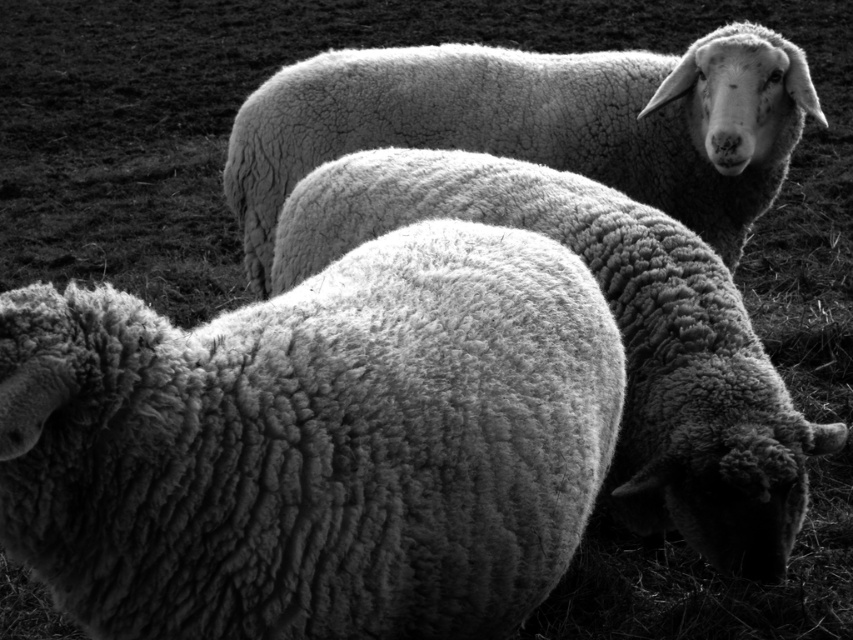
Which is more to the right, fuzzy woolly sheep at center or fuzzy woolen sheep at upper center?

fuzzy woolen sheep at upper center is more to the right.

Measure the distance between point (36, 547) and camera.

Point (36, 547) and camera are 4.34 feet apart.

Who is more distant from viewer, (x=387, y=324) or (x=686, y=60)?

The point (x=686, y=60) is behind.

Identify the location of fuzzy woolly sheep at center. The height and width of the screenshot is (640, 853). (314, 444).

Who is lower down, fuzzy woolly sheep at center or fuzzy woolen sheep at center?

Positioned lower is fuzzy woolly sheep at center.

Which is behind, point (549, 483) or point (688, 291)?

The point (688, 291) is more distant.

Find the location of a particular element. Image resolution: width=853 pixels, height=640 pixels. fuzzy woolly sheep at center is located at coordinates (314, 444).

Does fuzzy woolen sheep at center have a greater width compared to fuzzy woolen sheep at upper center?

Incorrect, fuzzy woolen sheep at center's width does not surpass fuzzy woolen sheep at upper center's.

Find the location of a particular element. Image resolution: width=853 pixels, height=640 pixels. fuzzy woolen sheep at center is located at coordinates (621, 337).

What do you see at coordinates (621, 337) in the screenshot? Image resolution: width=853 pixels, height=640 pixels. I see `fuzzy woolen sheep at center` at bounding box center [621, 337].

You are a GUI agent. You are given a task and a screenshot of the screen. Output one action in this format:
    pyautogui.click(x=<x>, y=<y>)
    Task: Click on the fuzzy woolen sheep at center
    This screenshot has width=853, height=640.
    Given the screenshot: What is the action you would take?
    pyautogui.click(x=621, y=337)